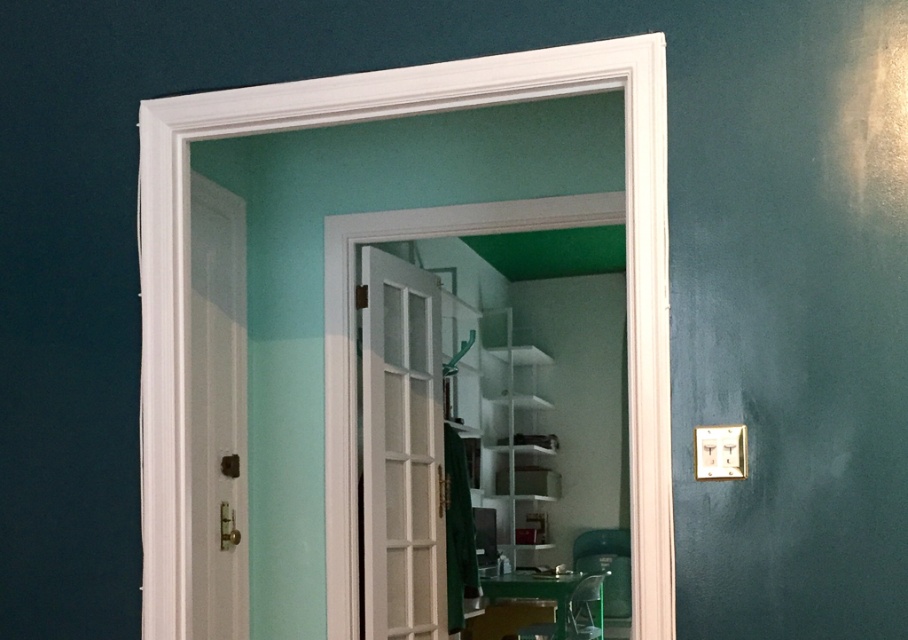
You are standing in the hallway and want to enter the room through the white glossy door at left. As you look through the doorway, can you see the white glossy bookshelf at center in the room?

The white glossy door at left is positioned over the white glossy bookshelf at center, so the door blocks your view of the bookshelf when looking through the doorway.